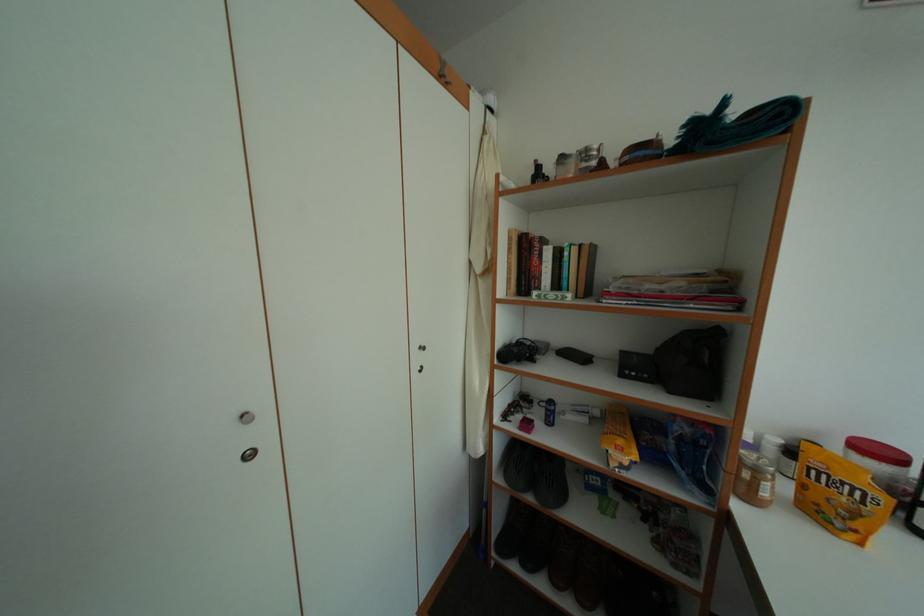
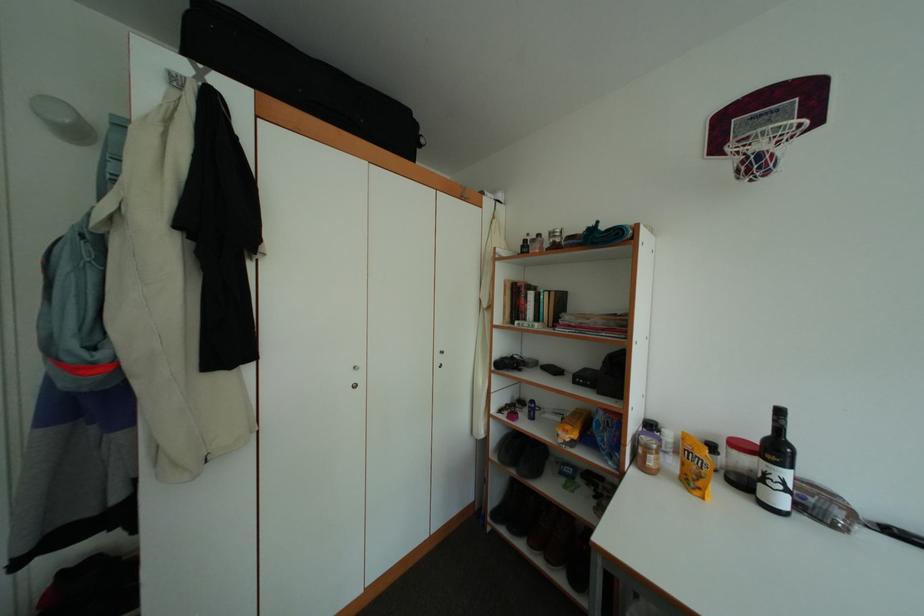
Question: Based on the continuous images, in which direction is the camera rotating? Reply with the corresponding letter.

Choices:
 (A) Left
 (B) Right
 (C) Up
 (D) Down

Answer: (A)